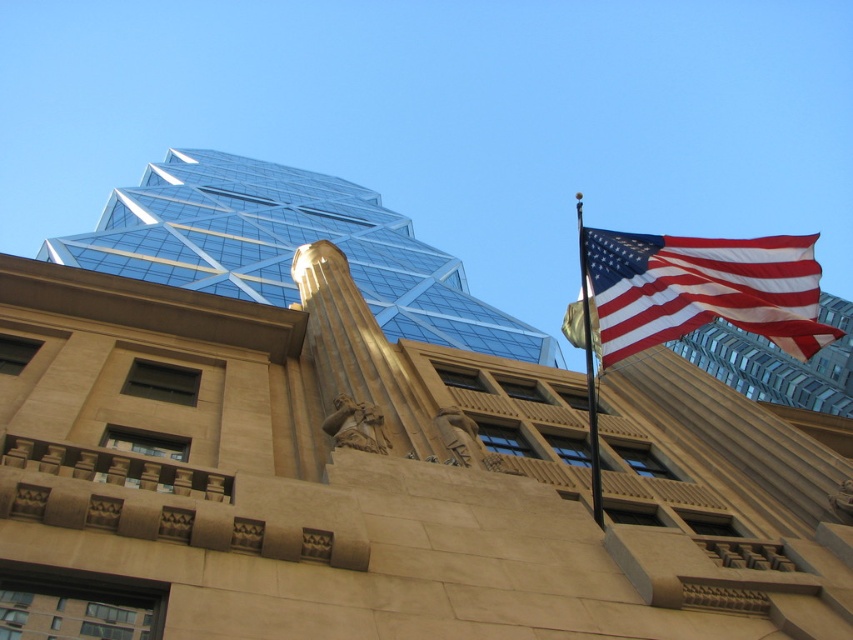
Is transparent glass tower at upper center further to the viewer compared to beige stone column at center?

Yes.

Locate an element on the screen. transparent glass tower at upper center is located at coordinates (289, 248).

Consider the image. Can you confirm if glassy steel tower at upper center is taller than black metal flag pole at upper right?

No.

Is point (821, 493) behind point (592, 424)?

Yes, it is.

Is point (827, 508) more distant than point (578, 212)?

That is False.

Where is `glassy steel tower at upper center`? This screenshot has height=640, width=853. glassy steel tower at upper center is located at coordinates (383, 481).

Who is shorter, red-white-striped fabric flag at upper right or beige stone column at center?

With less height is red-white-striped fabric flag at upper right.

Does red-white-striped fabric flag at upper right have a greater width compared to beige stone column at center?

Correct, the width of red-white-striped fabric flag at upper right exceeds that of beige stone column at center.

Which is behind, point (624, 236) or point (363, 349)?

The point (363, 349) is behind.

I want to click on red-white-striped fabric flag at upper right, so click(701, 289).